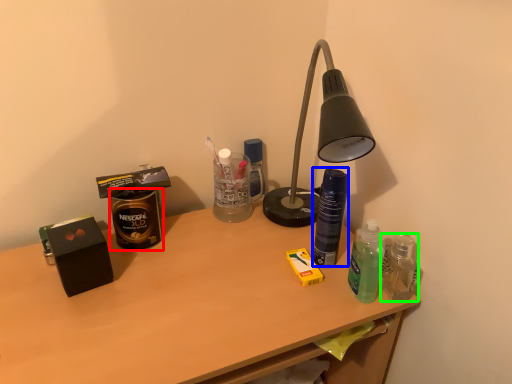
Question: Estimate the real-world distances between objects in this image. Which object is closer to beverage (highlighted by a red box), bottle (highlighted by a blue box) or bottle (highlighted by a green box)?

Choices:
 (A) bottle
 (B) bottle

Answer: (A)